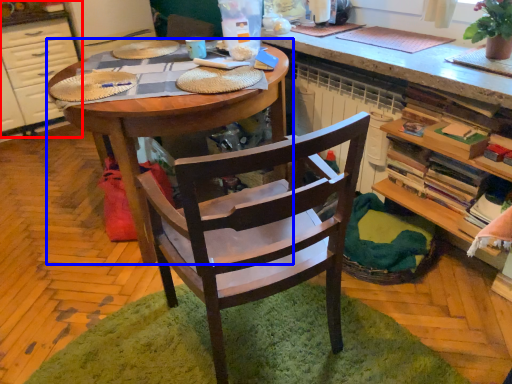
Question: Which object appears closest to the camera in this image, cabinetry (highlighted by a red box) or desk (highlighted by a blue box)?

Choices:
 (A) cabinetry
 (B) desk

Answer: (B)